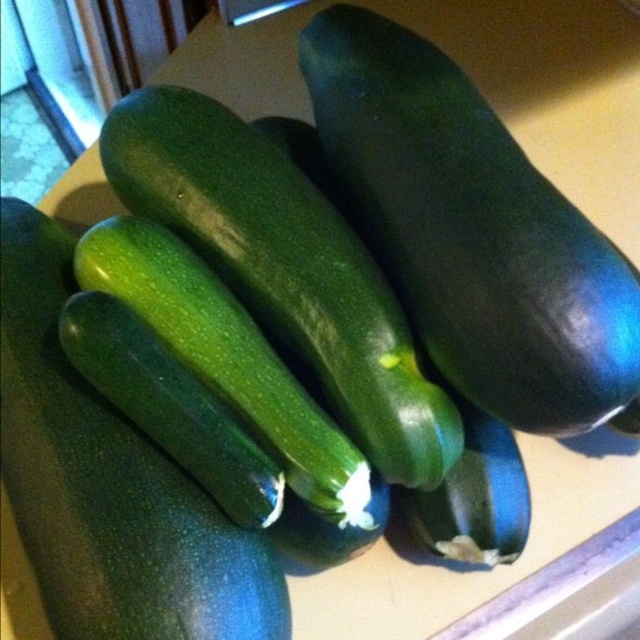
Consider the image. Can you confirm if green matte cucumber at center is positioned above green smooth skin cucumber at center?

Correct, green matte cucumber at center is located above green smooth skin cucumber at center.

Is green matte cucumber at center closer to camera compared to green smooth skin cucumber at center?

Yes, it is in front of green smooth skin cucumber at center.

At what (x,y) coordinates should I click in order to perform the action: click on green matte cucumber at center. Please return your answer as a coordinate pair (x, y). The height and width of the screenshot is (640, 640). Looking at the image, I should click on (472, 230).

Is point (612, 275) behind point (128, 624)?

Yes, it is.

Which is above, green matte cucumber at center or green smooth zucchini at center?

green matte cucumber at center

Between point (525, 400) and point (67, 502), which one is positioned in front?

Point (67, 502) is more forward.

Locate an element on the screen. The height and width of the screenshot is (640, 640). green matte cucumber at center is located at coordinates (472, 230).

Is green smooth zucchini at center smaller than green smooth skin cucumber at center?

Yes.

Is green smooth zucchini at center thinner than green smooth skin cucumber at center?

Yes.

What are the coordinates of `green smooth zucchini at center` in the screenshot? It's located at (108, 484).